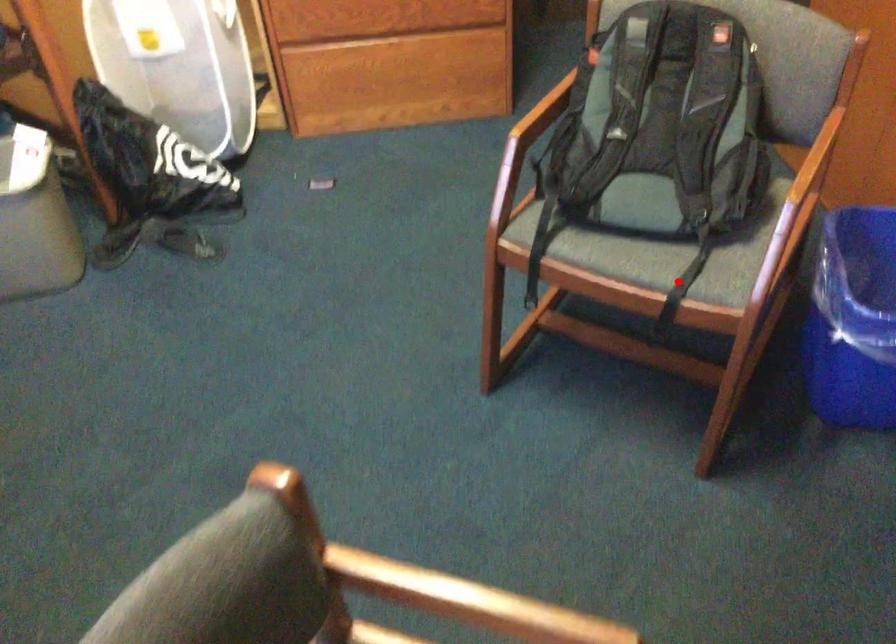
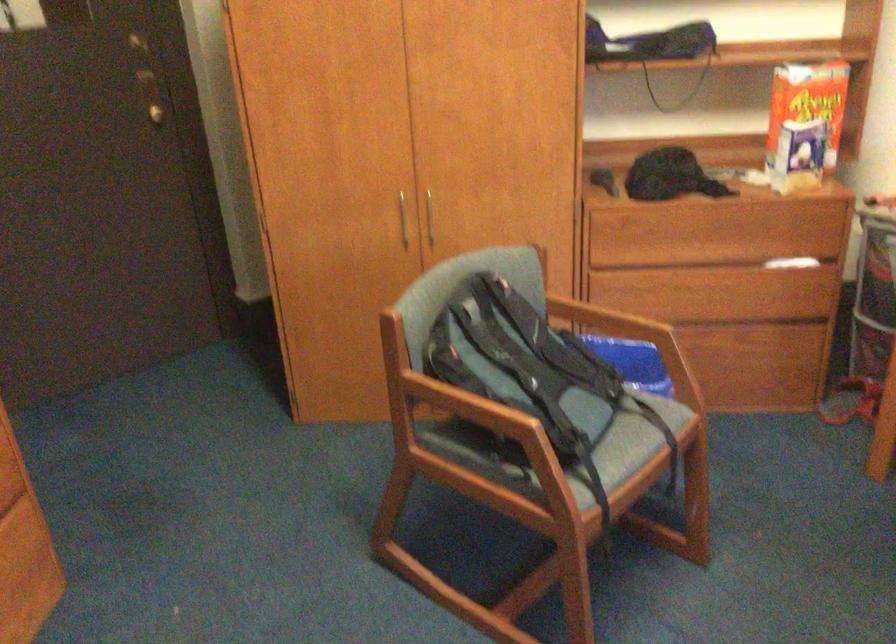
Question: I am providing you with two images of the same scene from different viewpoints. Given a red point in image1, look at the same physical point in image2. Is it:

Choices:
 (A) Closer to the viewpoint
 (B) Farther from the viewpoint

Answer: (B)